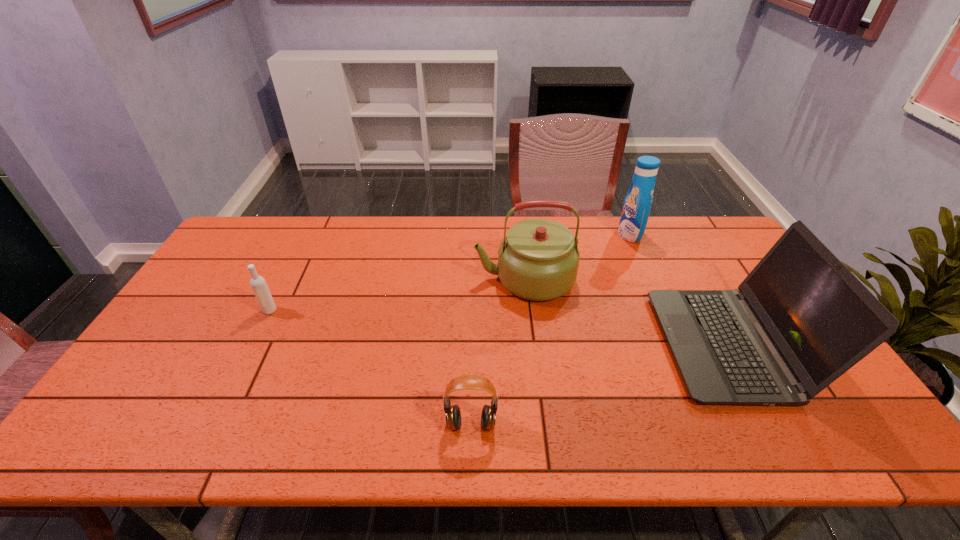
Identify which object is the second closest to the vodka. Please provide its 2D coordinates. Your answer should be formatted as a tuple, i.e. [(x, y)], where the tuple contains the x and y coordinates of a point satisfying the conditions above.

[(467, 381)]

Select which object appears as the fourth closest to the kettle. Please provide its 2D coordinates. Your answer should be formatted as a tuple, i.e. [(x, y)], where the tuple contains the x and y coordinates of a point satisfying the conditions above.

[(258, 284)]

You are a GUI agent. You are given a task and a screenshot of the screen. Output one action in this format:
    pyautogui.click(x=<x>, y=<y>)
    Task: Click on the free location that satisfies the following two spatial constraints: 1. at the spout of the kettle; 2. on the ear cups of the nearest object
    This screenshot has width=960, height=540.
    Given the screenshot: What is the action you would take?
    pyautogui.click(x=540, y=424)

Where is `vacant area that satisfies the following two spatial constraints: 1. on the front-facing side of the farthest object; 2. on the ear cups of the headset`? This screenshot has height=540, width=960. vacant area that satisfies the following two spatial constraints: 1. on the front-facing side of the farthest object; 2. on the ear cups of the headset is located at coordinates (713, 424).

Find the location of a particular element. vacant space that satisfies the following two spatial constraints: 1. at the spout of the kettle; 2. on the ear cups of the nearest object is located at coordinates (540, 424).